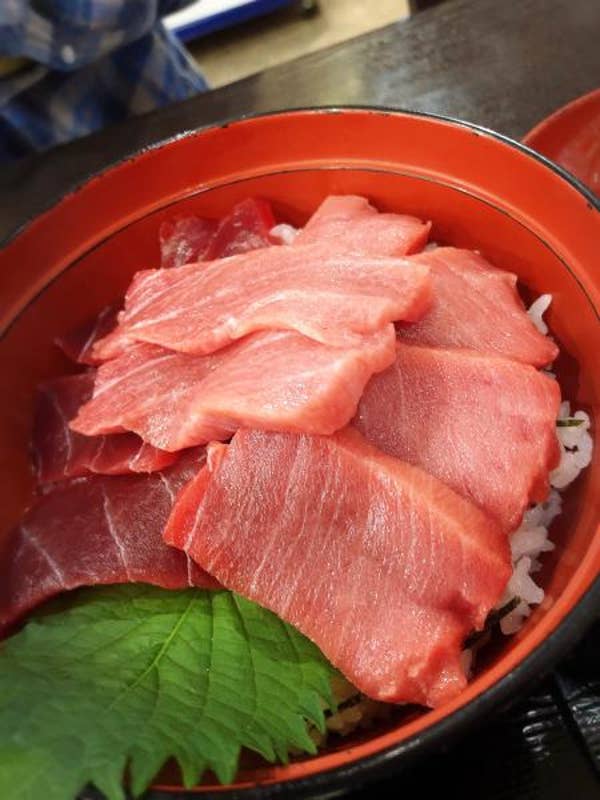
The width and height of the screenshot is (600, 800). Identify the location of red plate. (563, 126).